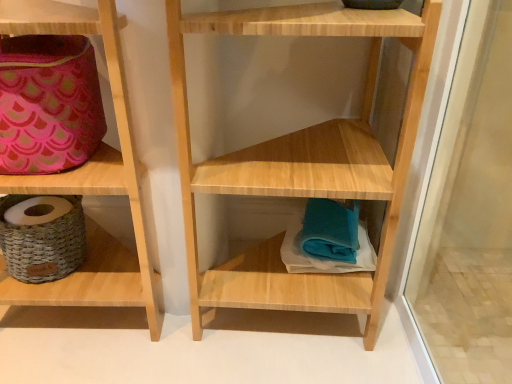
Measure the distance between natural wood shelf at center and camera.

The depth of natural wood shelf at center is 53.07 centimeters.

Describe the element at coordinates (301, 162) in the screenshot. This screenshot has width=512, height=384. I see `natural wood shelf at center` at that location.

The height and width of the screenshot is (384, 512). Identify the location of natural wood shelf at center. (301, 162).

The width and height of the screenshot is (512, 384). In order to click on natural wood shelf at center in this screenshot , I will do `click(301, 162)`.